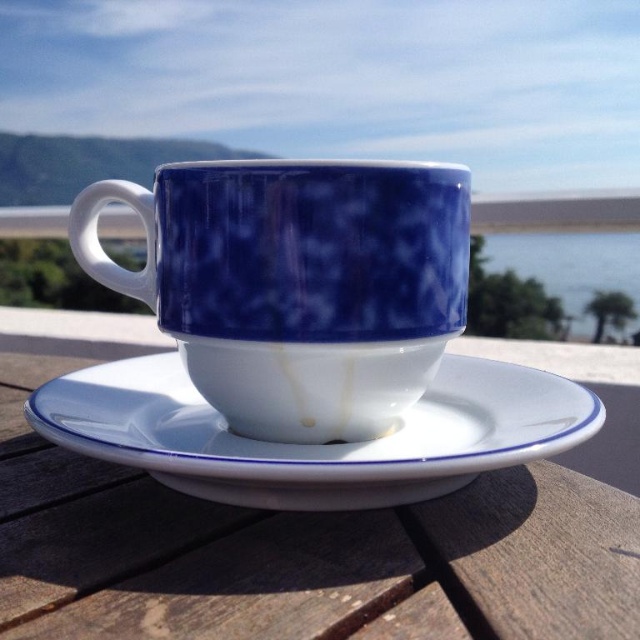
Question: Which point is closer to the camera?

Choices:
 (A) (506, 410)
 (B) (442, 499)
 (C) (288, 310)

Answer: (B)

Question: Can you confirm if blue glossy mug at center is thinner than white glossy saucer at center?

Choices:
 (A) yes
 (B) no

Answer: (A)

Question: From the image, what is the correct spatial relationship of white wood table at center in relation to white glossy saucer at center?

Choices:
 (A) left
 (B) right

Answer: (B)

Question: Is white wood table at center to the right of blue glass water at upper right from the viewer's perspective?

Choices:
 (A) yes
 (B) no

Answer: (B)

Question: Which point is farther from the camera taking this photo?

Choices:
 (A) (376, 608)
 (B) (227, 195)
 (C) (36, 392)
 (D) (524, 256)

Answer: (D)

Question: Which of the following is the farthest from the observer?

Choices:
 (A) (392, 202)
 (B) (76, 422)
 (C) (628, 636)
 (D) (593, 262)

Answer: (D)